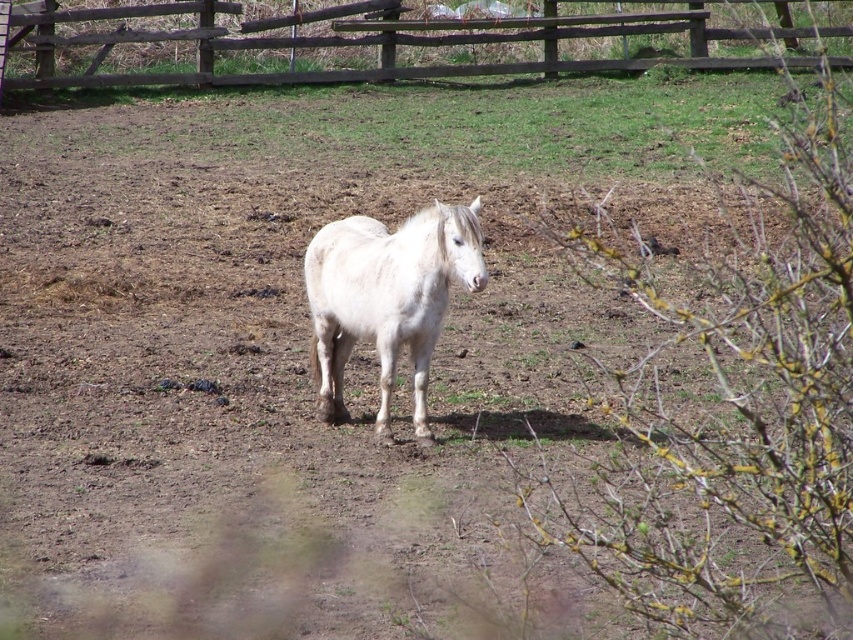
Is green grass at upper center below white matte horse at center?

No.

Find the location of a particular element. This screenshot has width=853, height=640. green grass at upper center is located at coordinates (416, 124).

This screenshot has width=853, height=640. Identify the location of green grass at upper center. (416, 124).

Which is more to the right, green grass at upper center or brown wooden fence at upper center?

Positioned to the right is brown wooden fence at upper center.

What do you see at coordinates (416, 124) in the screenshot? I see `green grass at upper center` at bounding box center [416, 124].

Where is `green grass at upper center`? green grass at upper center is located at coordinates (416, 124).

Does point (376, 67) lie behind point (352, 307)?

Yes, point (376, 67) is farther from viewer.

Is brown wooden fence at upper center taller than white matte horse at center?

Yes, brown wooden fence at upper center is taller than white matte horse at center.

Which is behind, point (88, 12) or point (346, 264)?

Positioned behind is point (88, 12).

Image resolution: width=853 pixels, height=640 pixels. I want to click on brown wooden fence at upper center, so click(x=398, y=42).